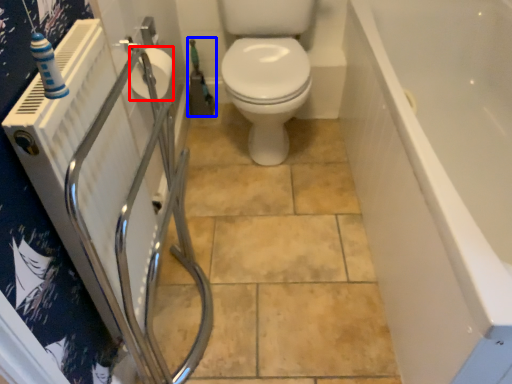
Question: Among these objects, which one is farthest to the camera, toilet paper (highlighted by a red box) or garden hose (highlighted by a blue box)?

Choices:
 (A) toilet paper
 (B) garden hose

Answer: (B)